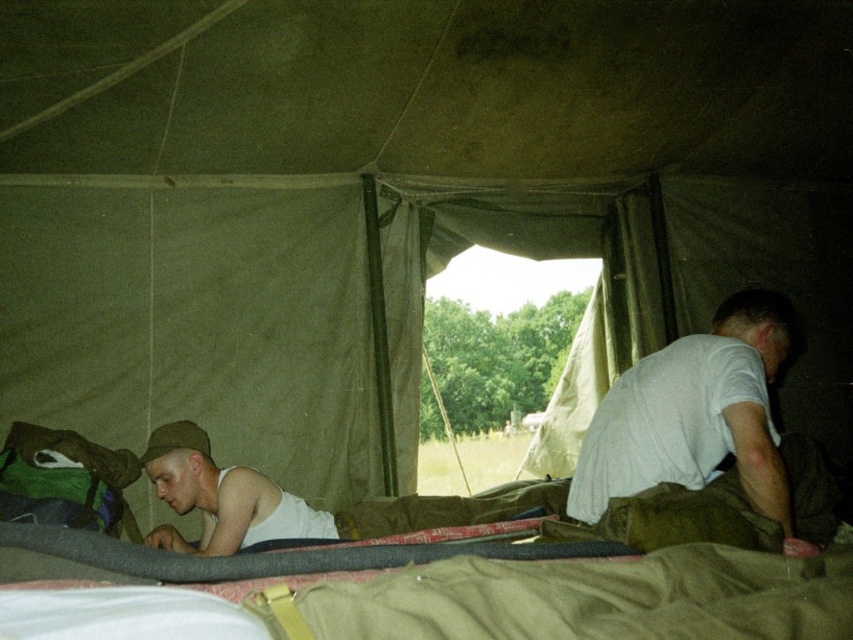
Question: Does khaki fabric at lower center have a greater width compared to white cotton shirt at right?

Choices:
 (A) no
 (B) yes

Answer: (B)

Question: Can you confirm if white cotton shirt at right is wider than white matte tank top at lower left?

Choices:
 (A) yes
 (B) no

Answer: (A)

Question: Which point appears closest to the camera in this image?

Choices:
 (A) (248, 483)
 (B) (619, 484)

Answer: (B)

Question: Which object appears closest to the camera in this image?

Choices:
 (A) khaki fabric at lower center
 (B) white cotton shirt at right

Answer: (A)

Question: Estimate the real-world distances between objects in this image. Which object is closer to the white cotton shirt at right?

Choices:
 (A) white matte tank top at lower left
 (B) khaki fabric at lower center

Answer: (B)

Question: Is khaki fabric at lower center wider than white matte tank top at lower left?

Choices:
 (A) no
 (B) yes

Answer: (B)